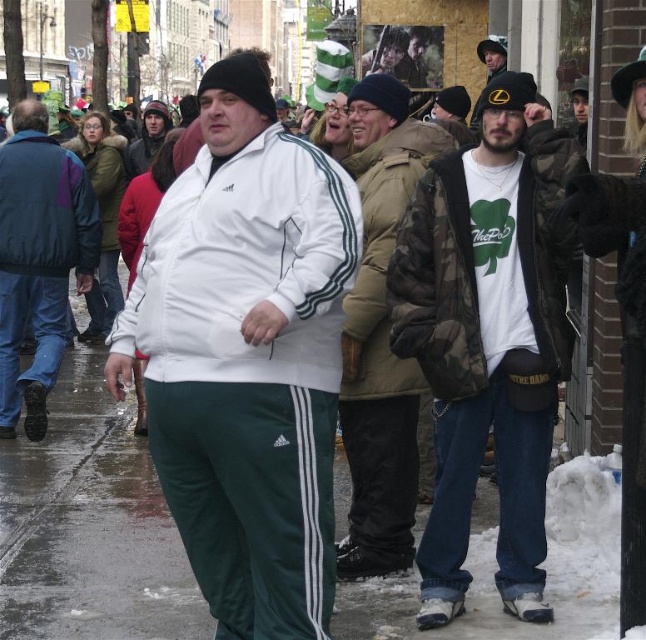
You are a fashion designer observing the street scene. You notice two jackets in the crowd. Which jacket, the camouflage jacket at center or the dark blue and green quilted jacket at left, is larger in size?

The camouflage jacket at center is bigger than the dark blue and green quilted jacket at left.

From the picture: You are a photographer trying to capture both the camouflage jacket at center and the dark blue and green quilted jacket at left in a single shot. Based on their positions, which jacket would appear closer to the camera in your photo?

The camouflage jacket at center appears closer to the camera because it is positioned above the dark blue and green quilted jacket at left, indicating it is nearer in the visual plane.

You are a fashion designer observing the street scene. You notice the green track pants at center and the camouflage jacket at center. Which clothing item has a greater horizontal span when viewed from the front?

The green track pants at center has a greater horizontal span when viewed from the front since its width is larger than the camouflage jacket at center.